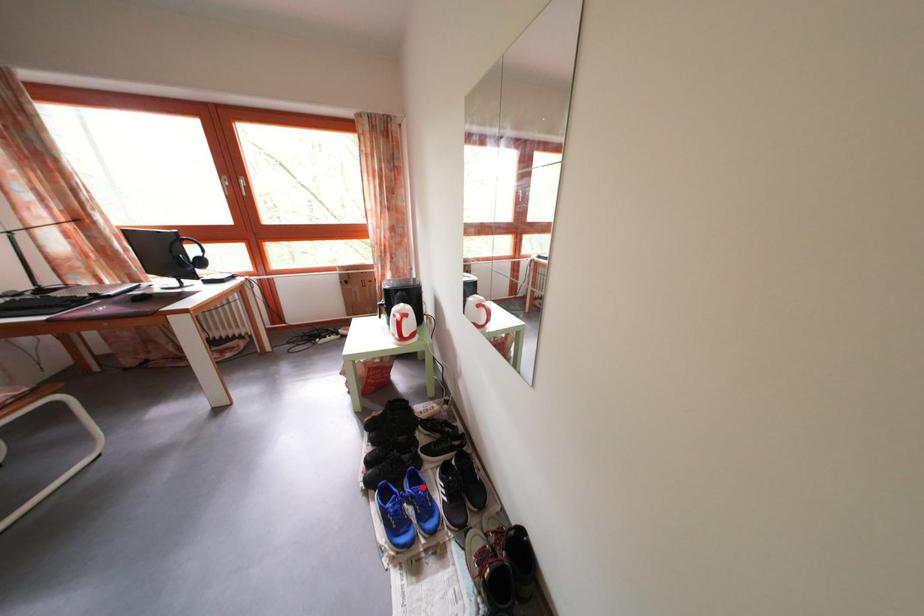
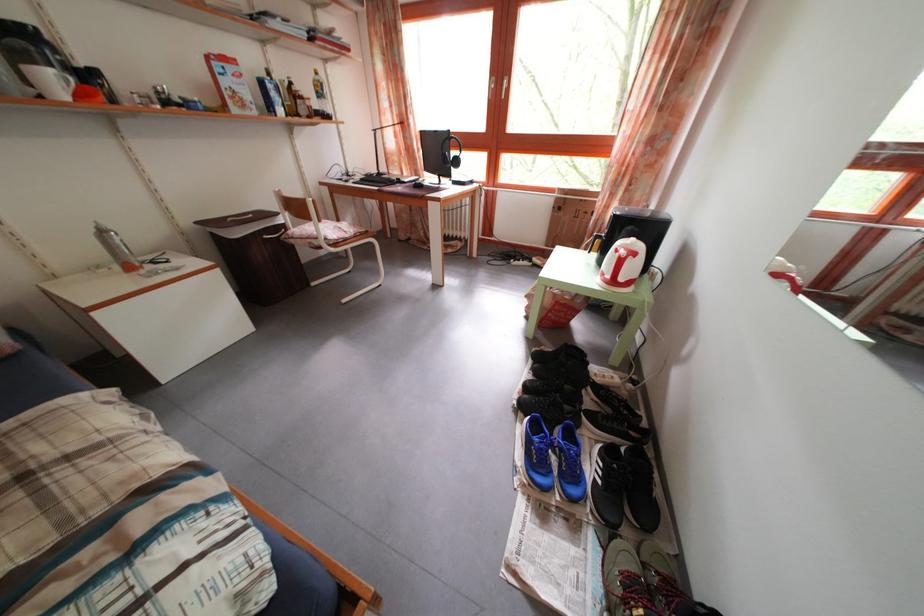
The point at the highlighted location is marked in the first image. Where is the corresponding point in the second image?

(578, 444)